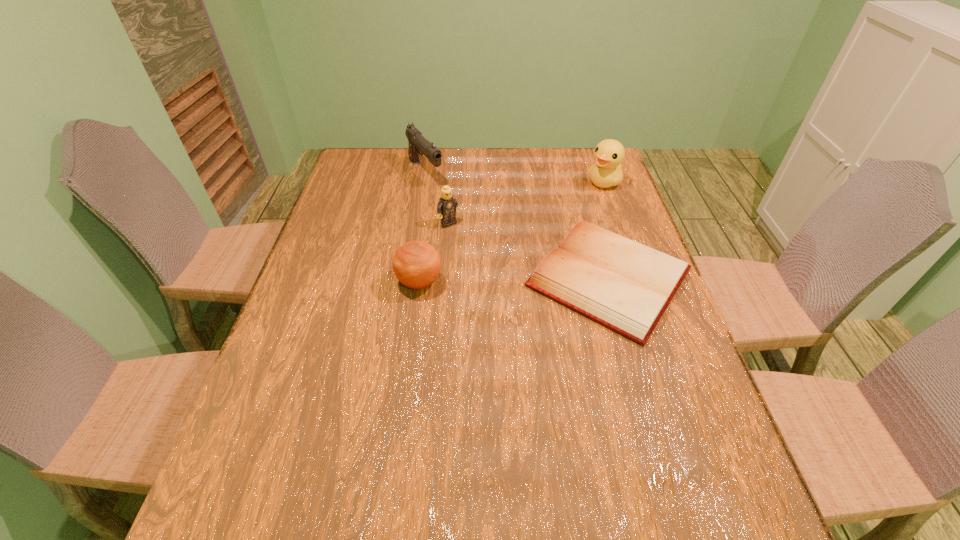
The image size is (960, 540). I want to click on orange, so click(416, 264).

The height and width of the screenshot is (540, 960). What are the coordinates of `the shortest object` in the screenshot? It's located at (626, 286).

Where is `gun`? The width and height of the screenshot is (960, 540). gun is located at coordinates (418, 144).

You are a GUI agent. You are given a task and a screenshot of the screen. Output one action in this format:
    pyautogui.click(x=<x>, y=<y>)
    Task: Click on the Lego
    
    Given the screenshot: What is the action you would take?
    pyautogui.click(x=447, y=207)

Where is `duck`? The height and width of the screenshot is (540, 960). duck is located at coordinates (608, 154).

Where is `vacant region located on the back of the orange`? vacant region located on the back of the orange is located at coordinates (432, 188).

Identify the location of free space located 0.260m on the front of the shortest object. Image resolution: width=960 pixels, height=540 pixels. (663, 463).

The image size is (960, 540). Find the location of `vacant space located in the direction the gun is aimed`. vacant space located in the direction the gun is aimed is located at coordinates (448, 202).

Find the location of a particular element. This screenshot has width=960, height=540. vacant space located in the direction the gun is aimed is located at coordinates (483, 239).

Locate an element on the screen. vacant space positioned 0.260m in the direction the gun is aimed is located at coordinates (474, 229).